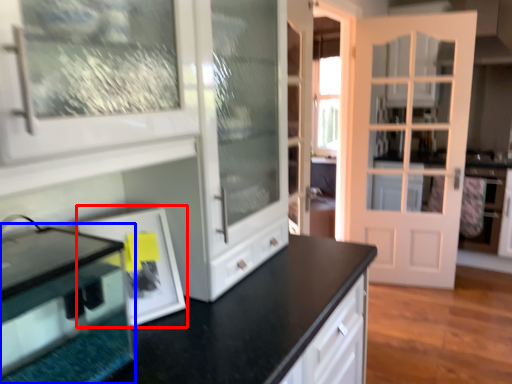
Question: Which of the following is the closest to the observer, picture frame (highlighted by a red box) or appliance (highlighted by a blue box)?

Choices:
 (A) picture frame
 (B) appliance

Answer: (B)